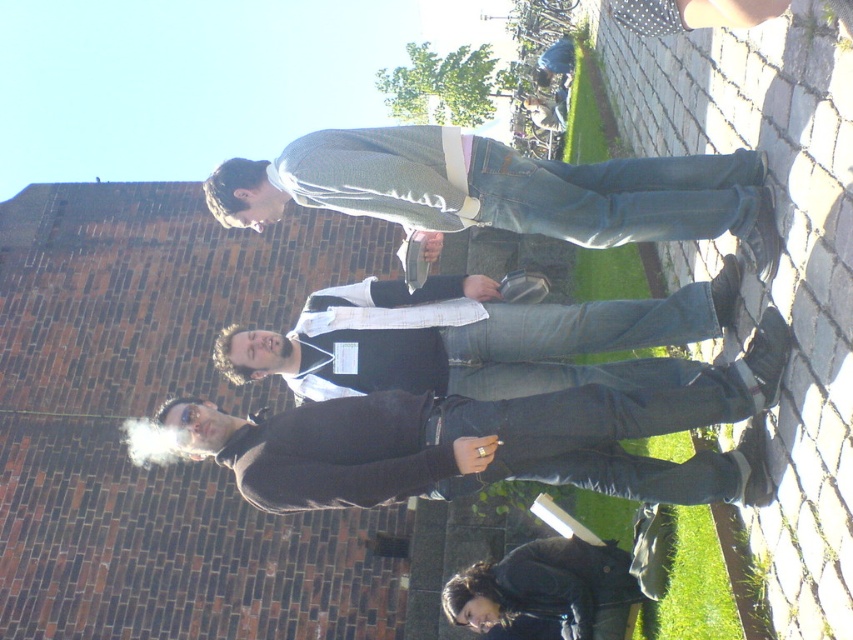
You are a photographer trying to capture a candid shot of the group. You notice the black matte jacket at center and the denim jeans at center. Which object should you focus on first if you want to ensure both are in the frame without moving the camera?

Answer: The black matte jacket at center is positioned under denim jeans at center, so focusing on the denim jeans at center first will ensure both are in the frame since the jacket is below it.

You are standing at the origin point in the image. Which direction should you move to reach the denim jeans at center?

The denim jeans at center is located at point 0.297 along the x and 0.590 along the y, so you should move to the right and forward to reach it.

You are a photographer positioned at the edge of the grassy area, aiming to capture a photo of the denim jeans at center and the dark brown leather jacket at lower center in the same frame. Given your camera has a maximum focus range of 15 meters, will both subjects be in focus?

The denim jeans at center and dark brown leather jacket at lower center are 16.15 meters apart. Since the camera can only focus up to 15 meters, the distance between them exceeds the focus range, meaning both subjects cannot be in focus simultaneously.